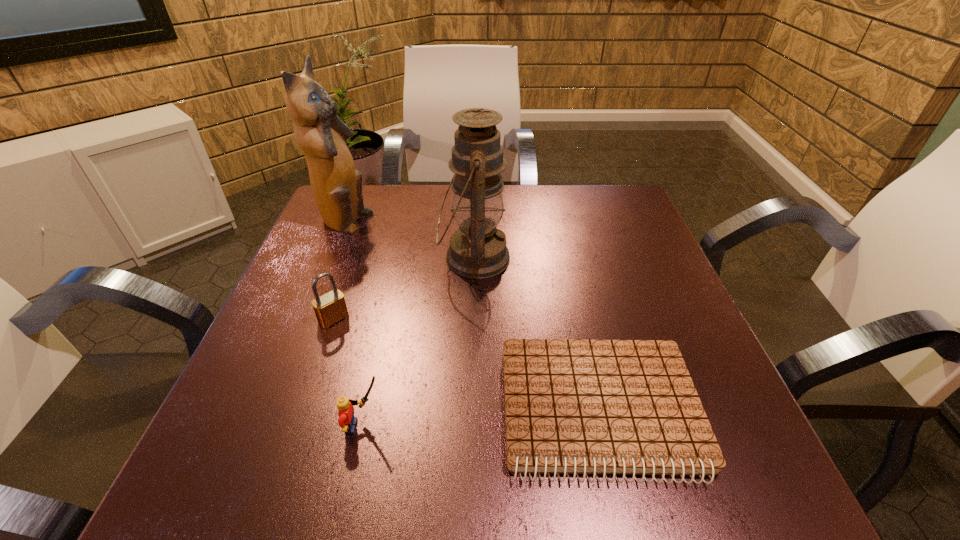
You are a GUI agent. You are given a task and a screenshot of the screen. Output one action in this format:
    pyautogui.click(x=<x>, y=<y>)
    Task: Click on the free space that satisfies the following two spatial constraints: 1. on the back side of the third farthest object; 2. on the face of the cat
    The image size is (960, 540).
    Given the screenshot: What is the action you would take?
    click(367, 223)

The height and width of the screenshot is (540, 960). In order to click on free space in the image that satisfies the following two spatial constraints: 1. on the face of the padlock; 2. on the left side of the cat in this screenshot , I will do `click(305, 319)`.

Where is `vacant space that satisfies the following two spatial constraints: 1. on the front side of the oil lamp; 2. on the right side of the shortest object`? This screenshot has height=540, width=960. vacant space that satisfies the following two spatial constraints: 1. on the front side of the oil lamp; 2. on the right side of the shortest object is located at coordinates 471,410.